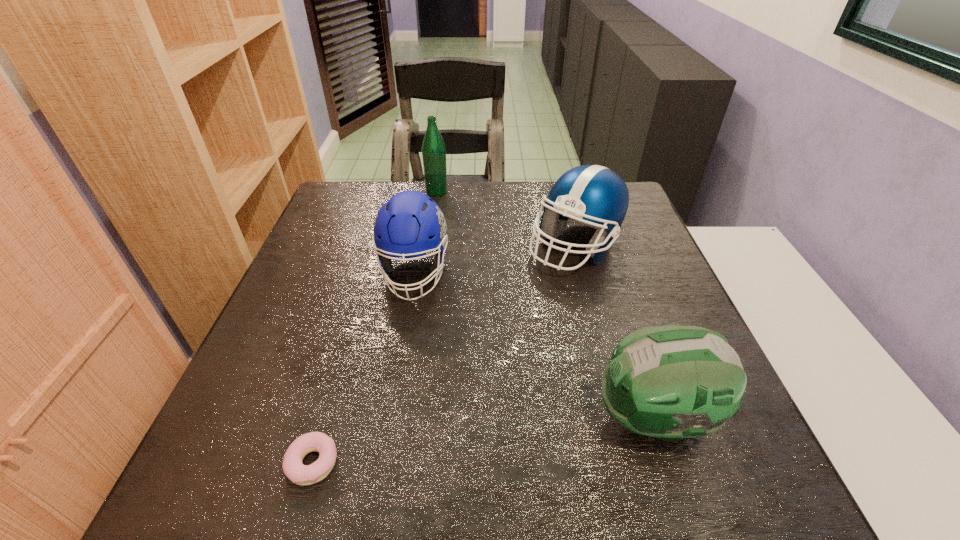
Identify the location of bottle that is at the far edge. (433, 147).

This screenshot has width=960, height=540. I want to click on football helmet at the far edge, so (x=591, y=195).

Identify the location of football helmet situated at the near edge. (671, 382).

At what (x,y) coordinates should I click in order to perform the action: click on doughnut that is at the near edge. Please return your answer as a coordinate pair (x, y). The height and width of the screenshot is (540, 960). Looking at the image, I should click on (300, 474).

Find the location of `object that is at the left edge`. object that is at the left edge is located at coordinates (300, 474).

Find the location of a particular element. object positioned at the near left corner is located at coordinates 300,474.

Find the location of a particular element. This screenshot has height=540, width=960. object that is at the far right corner is located at coordinates (591, 195).

Locate an element on the screen. This screenshot has width=960, height=540. object situated at the near right corner is located at coordinates (671, 382).

In order to click on vacant region at the far edge in this screenshot , I will do `click(468, 183)`.

Find the location of a particular element. vacant space at the near edge of the desktop is located at coordinates (541, 499).